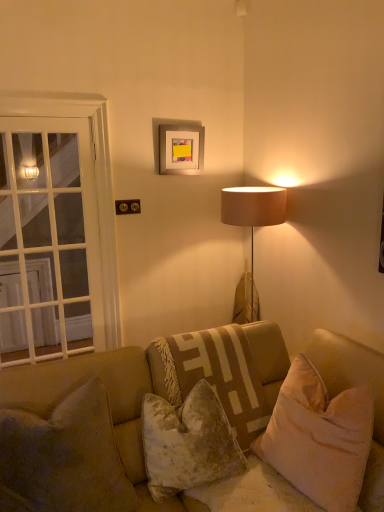
Question: From the image's perspective, is velvet beige pillow at center, marked as the third pillow in a left-to-right arrangement, positioned above or below velvety beige pillow at lower left, the 1th pillow viewed from the left?

Choices:
 (A) below
 (B) above

Answer: (B)

Question: Is point (246, 440) closer or farther from the camera than point (39, 452)?

Choices:
 (A) farther
 (B) closer

Answer: (A)

Question: Which of these objects is positioned closest to the white glass door at left?

Choices:
 (A) velvet beige pillow at center, marked as the third pillow in a left-to-right arrangement
 (B) velvety beige pillow at lower left, which is the fourth pillow from right to left
 (C) silver metallic picture frame at upper center
 (D) velvet beige couch at center
 (E) velvet beige pillow at lower right, positioned as the fourth pillow in left-to-right order

Answer: (C)

Question: Estimate the real-world distances between objects in this image. Which object is farther from the white glass door at left?

Choices:
 (A) velvet beige pillow at center, which is the third pillow in right-to-left order
 (B) silver metallic picture frame at upper center
 (C) velvety beige pillow at lower left, the 1th pillow viewed from the left
 (D) velvet beige pillow at center, marked as the third pillow in a left-to-right arrangement
 (E) velvet beige couch at center

Answer: (A)